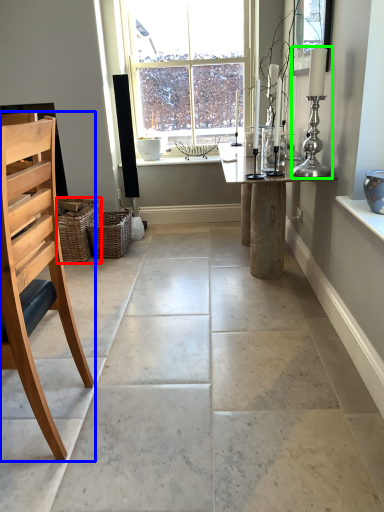
Question: Estimate the real-world distances between objects in this image. Which object is closer to basket (highlighted by a red box), chair (highlighted by a blue box) or candle holder (highlighted by a green box)?

Choices:
 (A) chair
 (B) candle holder

Answer: (A)